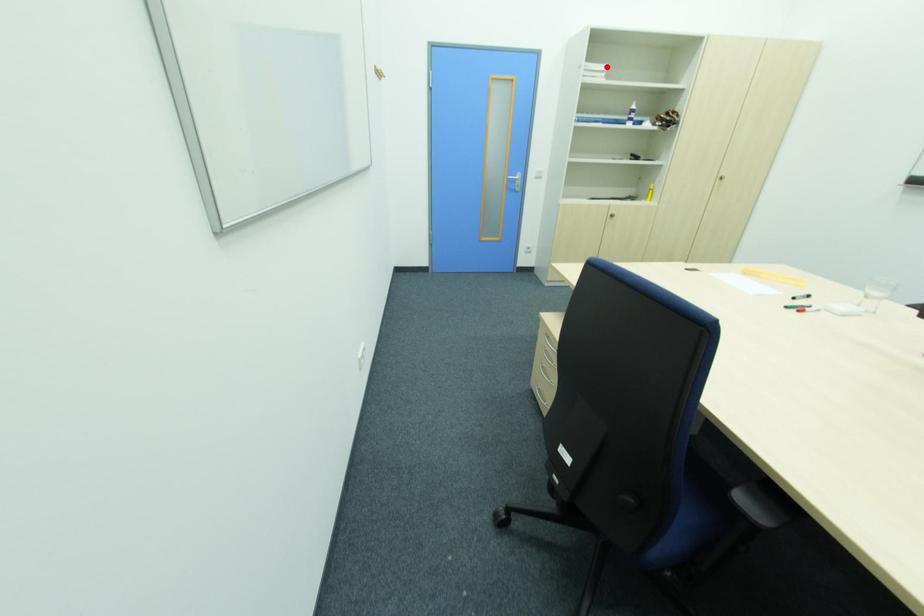
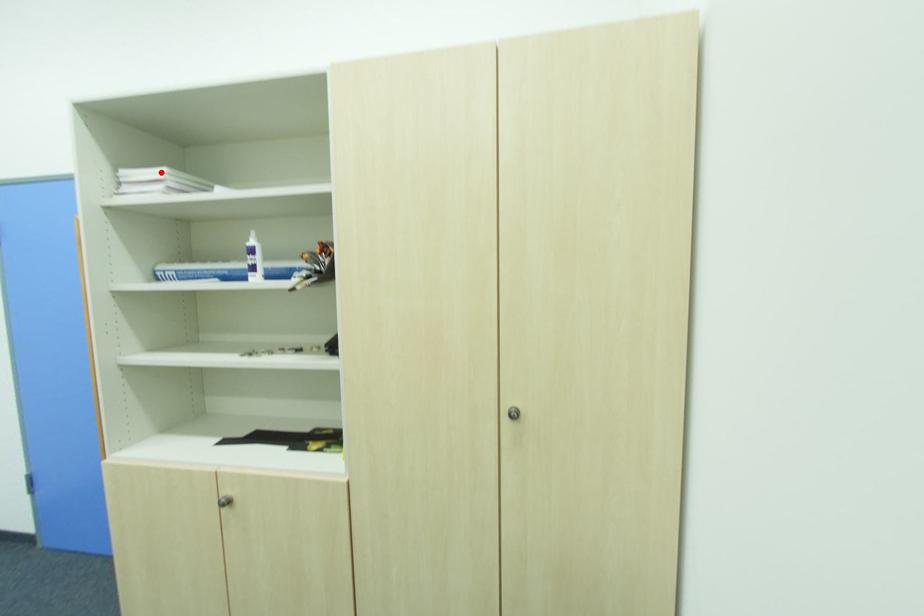
I am providing you with two images of the same scene from different viewpoints. A red point is marked on the first image and another point is marked on the second image. Do the highlighted points in image1 and image2 indicate the same real-world spot?

Yes